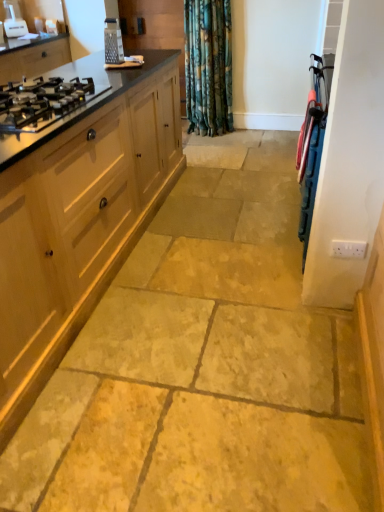
Question: Is black glass gas stove at left outside white plastic appliance at upper left, which is the first appliance from top to bottom?

Choices:
 (A) yes
 (B) no

Answer: (A)

Question: Is white plastic appliance at upper left, the first appliance when ordered from back to front, completely or partially inside black glass gas stove at left?

Choices:
 (A) no
 (B) yes

Answer: (A)

Question: From the image's perspective, does black glass gas stove at left appear lower than white plastic appliance at upper left, which appears as the 2th appliance when ordered from the bottom?

Choices:
 (A) yes
 (B) no

Answer: (A)

Question: Considering the relative sizes of black glass gas stove at left and white plastic appliance at upper left, the second appliance viewed from the front, in the image provided, is black glass gas stove at left smaller than white plastic appliance at upper left, the second appliance viewed from the front,?

Choices:
 (A) yes
 (B) no

Answer: (B)

Question: From a real-world perspective, does black glass gas stove at left stand above white plastic appliance at upper left, the first appliance when ordered from back to front?

Choices:
 (A) yes
 (B) no

Answer: (B)

Question: Considering the relative sizes of black glass gas stove at left and white plastic appliance at upper left, the 1th appliance positioned from the left, in the image provided, is black glass gas stove at left bigger than white plastic appliance at upper left, the 1th appliance positioned from the left,?

Choices:
 (A) yes
 (B) no

Answer: (A)

Question: Can you confirm if light wood cabinet at left, placed as the first cabinetry when sorted from front to back, is taller than white plastic appliance at upper left, the second appliance viewed from the front?

Choices:
 (A) no
 (B) yes

Answer: (B)

Question: From a real-world perspective, is light wood cabinet at left, which ranks as the second cabinetry in left-to-right order, physically below white plastic appliance at upper left, the first appliance when ordered from back to front?

Choices:
 (A) yes
 (B) no

Answer: (A)

Question: Can you confirm if light wood cabinet at left, which ranks as the second cabinetry in left-to-right order, is smaller than white plastic appliance at upper left, the 1th appliance positioned from the left?

Choices:
 (A) no
 (B) yes

Answer: (A)

Question: Is light wood cabinet at left, placed as the 1th cabinetry when sorted from right to left, positioned behind white plastic appliance at upper left, the second appliance viewed from the front?

Choices:
 (A) no
 (B) yes

Answer: (A)

Question: Is light wood cabinet at left, placed as the 1th cabinetry when sorted from right to left, directly adjacent to white plastic appliance at upper left, the first appliance when ordered from back to front?

Choices:
 (A) yes
 (B) no

Answer: (B)

Question: Is white plastic appliance at upper left, the first appliance when ordered from back to front, at the back of light wood cabinet at left, which is the first cabinetry from bottom to top?

Choices:
 (A) no
 (B) yes

Answer: (A)

Question: Is matte wood stove at upper left, which appears as the first cabinetry when viewed from the back, facing away from black glass gas stove at left?

Choices:
 (A) no
 (B) yes

Answer: (A)